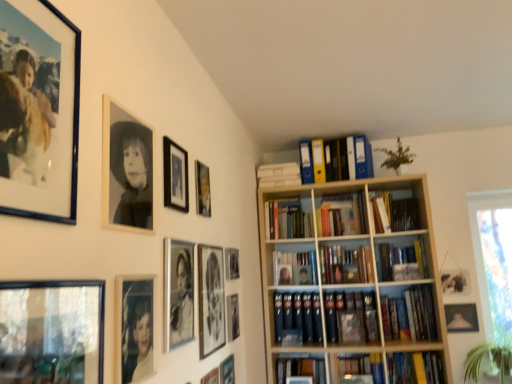
How much space does matte gold picture frame at lower right, which is the first picture frame from right to left, occupy vertically?

The height of matte gold picture frame at lower right, which is the first picture frame from right to left, is 7.16 inches.

I want to click on matte gold picture frame at lower right, which is the first picture frame from right to left, so click(x=461, y=317).

The width and height of the screenshot is (512, 384). What do you see at coordinates (349, 277) in the screenshot?
I see `wooden bookcase at center` at bounding box center [349, 277].

The height and width of the screenshot is (384, 512). What do you see at coordinates (415, 367) in the screenshot? I see `hardcover book at lower right, which is the 5th book from top to bottom` at bounding box center [415, 367].

Locate an element on the screen. The image size is (512, 384). green leafy plant at lower right, marked as the 1th plant in a bottom-to-top arrangement is located at coordinates (490, 358).

Where is `matte black photo frame at upper center, placed as the 7th picture frame when sorted from left to right`? The image size is (512, 384). matte black photo frame at upper center, placed as the 7th picture frame when sorted from left to right is located at coordinates (203, 189).

Considering the points (4, 368) and (392, 264), which point is behind, point (4, 368) or point (392, 264)?

The point (392, 264) is farther from the camera.

Considering the sizes of objects clear glass window at lower left, marked as the second picture frame in a left-to-right arrangement, and hardcover book at center, the third book from the top, in the image provided, who is smaller, clear glass window at lower left, marked as the second picture frame in a left-to-right arrangement, or hardcover book at center, the third book from the top,?

Smaller between the two is clear glass window at lower left, marked as the second picture frame in a left-to-right arrangement.

Is clear glass window at lower left, positioned as the 12th picture frame in right-to-left order, to the left of hardcover book at center, the third book from the top, from the viewer's perspective?

Yes.

From the picture: Between clear glass window at lower left, positioned as the 12th picture frame in right-to-left order, and hardcover book at center, placed as the 3th book when sorted from bottom to top, which one has less height?

hardcover book at center, placed as the 3th book when sorted from bottom to top, is shorter.

Between clear glass window at lower left, positioned as the 12th picture frame in right-to-left order, and black matte photo frame at upper center, the eleventh picture frame in the right-to-left sequence, which one has larger size?

With larger size is clear glass window at lower left, positioned as the 12th picture frame in right-to-left order.

Looking at this image, are clear glass window at lower left, marked as the second picture frame in a left-to-right arrangement, and black matte photo frame at upper center, the eleventh picture frame in the right-to-left sequence, located far from each other?

No, there isn't a large distance between clear glass window at lower left, marked as the second picture frame in a left-to-right arrangement, and black matte photo frame at upper center, the eleventh picture frame in the right-to-left sequence.

Which is in front, clear glass window at lower left, marked as the second picture frame in a left-to-right arrangement, or black matte photo frame at upper center, the eleventh picture frame in the right-to-left sequence?

Positioned in front is clear glass window at lower left, marked as the second picture frame in a left-to-right arrangement.

Considering the relative sizes of clear glass window at lower left, marked as the second picture frame in a left-to-right arrangement, and black matte photo frame at upper center, the eleventh picture frame in the right-to-left sequence, in the image provided, is clear glass window at lower left, marked as the second picture frame in a left-to-right arrangement, shorter than black matte photo frame at upper center, the eleventh picture frame in the right-to-left sequence,?

In fact, clear glass window at lower left, marked as the second picture frame in a left-to-right arrangement, may be taller than black matte photo frame at upper center, the eleventh picture frame in the right-to-left sequence.

In the scene shown: Is hardcover book at lower right, which is the 5th book from top to bottom, bigger or smaller than matte black picture frame at upper left, which is counted as the 1th picture frame, starting from the left?

In the image, hardcover book at lower right, which is the 5th book from top to bottom, appears to be larger than matte black picture frame at upper left, which is counted as the 1th picture frame, starting from the left.

How far apart are hardcover book at lower right, the 1th book when ordered from bottom to top, and matte black picture frame at upper left, placed as the 13th picture frame when sorted from right to left?

hardcover book at lower right, the 1th book when ordered from bottom to top, is 7.66 feet from matte black picture frame at upper left, placed as the 13th picture frame when sorted from right to left.

From the image's perspective, does hardcover book at lower right, which is the 5th book from top to bottom, appear higher than matte black picture frame at upper left, which is counted as the 1th picture frame, starting from the left?

No.

Do you think wooden bookcase at center is within matte black picture frame at upper center, the 5th picture frame from the left, or outside of it?

wooden bookcase at center is not inside matte black picture frame at upper center, the 5th picture frame from the left, it's outside.

From the image's perspective, which is below, wooden bookcase at center or matte black picture frame at upper center, the 5th picture frame from the left?

wooden bookcase at center is shown below in the image.

Considering the sizes of objects wooden bookcase at center and matte black picture frame at upper center, the 5th picture frame from the left, in the image provided, who is bigger, wooden bookcase at center or matte black picture frame at upper center, the 5th picture frame from the left,?

wooden bookcase at center.

From a real-world perspective, does wooden bookcase at center sit lower than matte black picture frame at upper center, the 9th picture frame from the right?

Yes, from a real-world perspective, wooden bookcase at center is beneath matte black picture frame at upper center, the 9th picture frame from the right.

Is green leafy plant at upper center, which is the first plant from top to bottom, taller than hardcover book at center, which is counted as the 4th book, starting from the top?

Incorrect, the height of green leafy plant at upper center, which is the first plant from top to bottom, is not larger of that of hardcover book at center, which is counted as the 4th book, starting from the top.

Based on the photo, from the image's perspective, between green leafy plant at upper center, marked as the first plant in a left-to-right arrangement, and hardcover book at center, marked as the second book in a bottom-to-top arrangement, who is located below?

hardcover book at center, marked as the second book in a bottom-to-top arrangement, is shown below in the image.

Which is more distant, (398, 148) or (419, 298)?

The point (398, 148) is farther from the camera.

Is green leafy plant at upper center, marked as the first plant in a left-to-right arrangement, inside the boundaries of hardcover book at center, which is counted as the 4th book, starting from the top, or outside?

green leafy plant at upper center, marked as the first plant in a left-to-right arrangement, cannot be found inside hardcover book at center, which is counted as the 4th book, starting from the top.

From the picture: From a real-world perspective, who is located lower, matte black picture frame at upper left, which is counted as the 1th picture frame, starting from the left, or hardcover book at lower right, the 1th book when ordered from bottom to top?

In real-world perspective, hardcover book at lower right, the 1th book when ordered from bottom to top, is lower.

How different are the orientations of matte black picture frame at upper left, which is counted as the 1th picture frame, starting from the left, and hardcover book at lower right, the 1th book when ordered from bottom to top, in degrees?

The angle between the facing direction of matte black picture frame at upper left, which is counted as the 1th picture frame, starting from the left, and the facing direction of hardcover book at lower right, the 1th book when ordered from bottom to top, is 90.1 degrees.

From the image's perspective, starting from the matte black picture frame at upper left, placed as the 13th picture frame when sorted from right to left, which book is the 4th one below? Please provide its 2D coordinates.

[(415, 367)]

Between yellow plastic file at upper center, which appears as the fifth book when ordered from the bottom, and metallic silver picture frame at center, the 12th picture frame from the left, which one has larger width?

yellow plastic file at upper center, which appears as the fifth book when ordered from the bottom.

Consider the image. From the image's perspective, between yellow plastic file at upper center, which appears as the fifth book when ordered from the bottom, and metallic silver picture frame at center, the 12th picture frame from the left, who is located below?

metallic silver picture frame at center, the 12th picture frame from the left, from the image's perspective.

Considering the sizes of yellow plastic file at upper center, which appears as the fifth book when ordered from the bottom, and metallic silver picture frame at center, the 12th picture frame from the left, in the image, is yellow plastic file at upper center, which appears as the fifth book when ordered from the bottom, bigger or smaller than metallic silver picture frame at center, the 12th picture frame from the left,?

Considering their sizes, yellow plastic file at upper center, which appears as the fifth book when ordered from the bottom, takes up more space than metallic silver picture frame at center, the 12th picture frame from the left.

Which is more to the right, yellow plastic file at upper center, which appears as the fifth book when ordered from the bottom, or metallic silver picture frame at center, the 12th picture frame from the left?

yellow plastic file at upper center, which appears as the fifth book when ordered from the bottom.

There is a hardcover book at center, placed as the 3th book when sorted from bottom to top. Find the location of `the 4th picture frame below it (from a real-world perspective)`. the 4th picture frame below it (from a real-world perspective) is located at coordinates (52, 331).

Image resolution: width=512 pixels, height=384 pixels. I want to click on the 3rd picture frame behind the clear glass window at lower left, marked as the second picture frame in a left-to-right arrangement, so click(126, 170).

Estimate the real-world distances between objects in this image. Which object is closer to matte black picture frame at lower center, the 4th picture frame positioned from the right, hardcover book at lower right, which is the 5th book from top to bottom, or matte black picture frame at center left, positioned as the 8th picture frame in right-to-left order?

Among the two, matte black picture frame at center left, positioned as the 8th picture frame in right-to-left order, is located nearer to matte black picture frame at lower center, the 4th picture frame positioned from the right.

When comparing their distances from matte black picture frame at upper left, which is counted as the 1th picture frame, starting from the left, does hardcover book at center, placed as the 3th book when sorted from bottom to top, or hardcover book at lower right, which is the 5th book from top to bottom, seem further?

Based on the image, hardcover book at lower right, which is the 5th book from top to bottom, appears to be further to matte black picture frame at upper left, which is counted as the 1th picture frame, starting from the left.

Based on their spatial positions, is hardcover books at upper right, which is the fourth book from bottom to top, or metallic silver picture frame at center, the second picture frame positioned from the right, further from matte glass photo frame at lower left, the tenth picture frame from the right?

hardcover books at upper right, which is the fourth book from bottom to top, is positioned further to the anchor matte glass photo frame at lower left, the tenth picture frame from the right.

Considering their positions, is matte black picture frame at center left, acting as the 6th picture frame starting from the left, positioned further to hardcover book at center, which is counted as the 4th book, starting from the top, than matte black photo frame at upper center, the seventh picture frame positioned from the right?

matte black picture frame at center left, acting as the 6th picture frame starting from the left, lies further to hardcover book at center, which is counted as the 4th book, starting from the top, than the other object.

Based on their spatial positions, is matte black picture frame at upper center, the 11th picture frame positioned from the left, or matte gold picture frame at lower right, the 13th picture frame when ordered from left to right, further from matte black picture frame at upper left, placed as the 13th picture frame when sorted from right to left?

Based on the image, matte gold picture frame at lower right, the 13th picture frame when ordered from left to right, appears to be further to matte black picture frame at upper left, placed as the 13th picture frame when sorted from right to left.

From the image, which object appears to be nearer to hardcover books at upper right, which is the fourth book from bottom to top, metallic silver picture frame at center, the 12th picture frame from the left, or yellow plastic file at upper center, which appears as the fifth book when ordered from the bottom?

yellow plastic file at upper center, which appears as the fifth book when ordered from the bottom.

From the image, which object appears to be nearer to black matte photo frame at upper center, the third picture frame positioned from the left, yellow plastic file at upper center, which appears as the fifth book when ordered from the bottom, or matte black picture frame at center left, positioned as the 8th picture frame in right-to-left order?

The object closer to black matte photo frame at upper center, the third picture frame positioned from the left, is matte black picture frame at center left, positioned as the 8th picture frame in right-to-left order.

Considering their positions, is green leafy plant at lower right, marked as the 1th plant in a bottom-to-top arrangement, positioned further to wooden bookcase at center than matte black picture frame at upper center, the 5th picture frame from the left?

matte black picture frame at upper center, the 5th picture frame from the left.

The image size is (512, 384). Find the location of `bookcase between matte glass photo frame at lower left, arranged as the 4th picture frame when viewed from the left, and hardcover books at upper right, which is the 2th book from top to bottom, in the front-back direction`. bookcase between matte glass photo frame at lower left, arranged as the 4th picture frame when viewed from the left, and hardcover books at upper right, which is the 2th book from top to bottom, in the front-back direction is located at coordinates (349, 277).

The image size is (512, 384). What are the coordinates of `plant located between matte black picture frame at lower center, which appears as the tenth picture frame when viewed from the left, and hardcover books at upper right, which is the 2th book from top to bottom, in the left-right direction` in the screenshot? It's located at (396, 156).

Locate an element on the screen. plant between matte black photo frame at upper center, the seventh picture frame positioned from the right, and hardcover book at center, marked as the second book in a bottom-to-top arrangement, in the horizontal direction is located at coordinates (396, 156).

Locate an element on the screen. picture frame located between metallic silver picture frame at center, the second picture frame positioned from the right, and yellow plastic file at upper center, placed as the 1th book when sorted from top to bottom, in the depth direction is located at coordinates (232, 263).